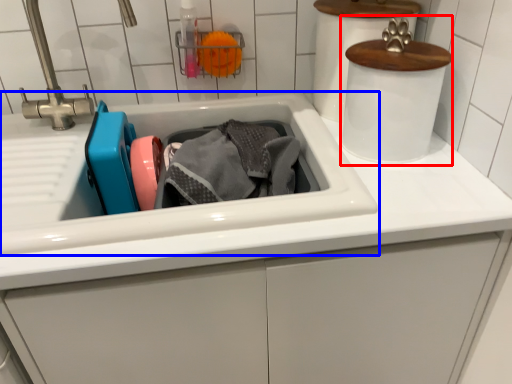
Question: Which of the following is the farthest to the observer, appliance (highlighted by a red box) or sink (highlighted by a blue box)?

Choices:
 (A) appliance
 (B) sink

Answer: (A)